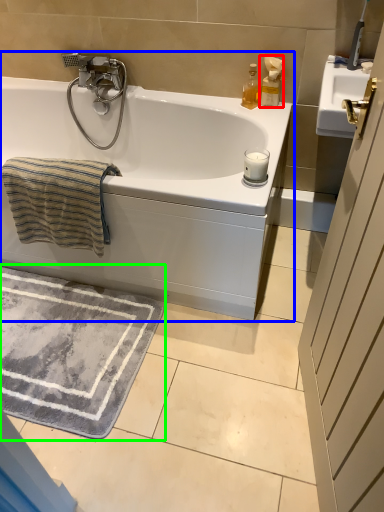
Question: Which is farther away from soap dispenser (highlighted by a red box)? bathtub (highlighted by a blue box) or bath mat (highlighted by a green box)?

Choices:
 (A) bathtub
 (B) bath mat

Answer: (B)